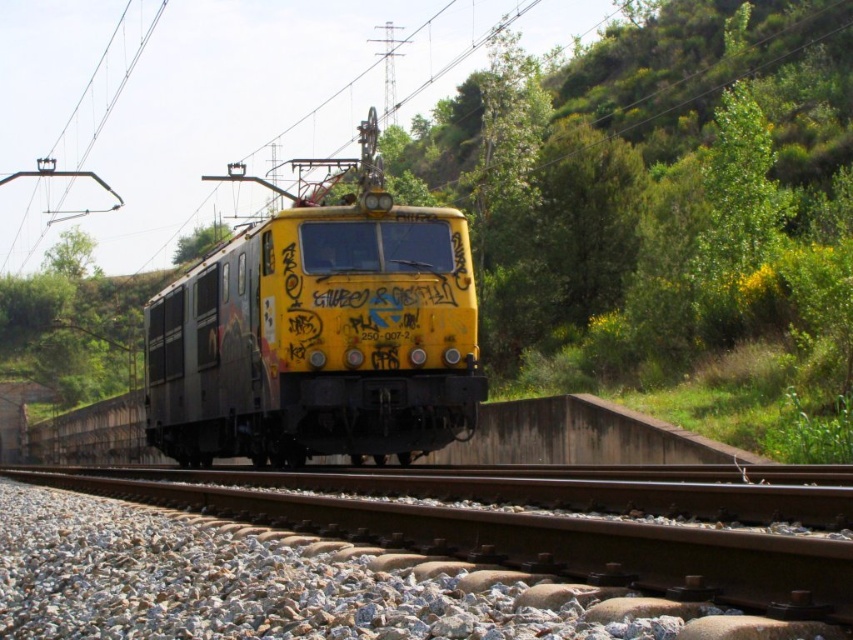
You are a maintenance worker checking the railway tracks. You notice the gray gravel at bottom and the yellow matte train at center. Which one has a greater width?

The gray gravel at bottom might be wider than yellow matte train at center.